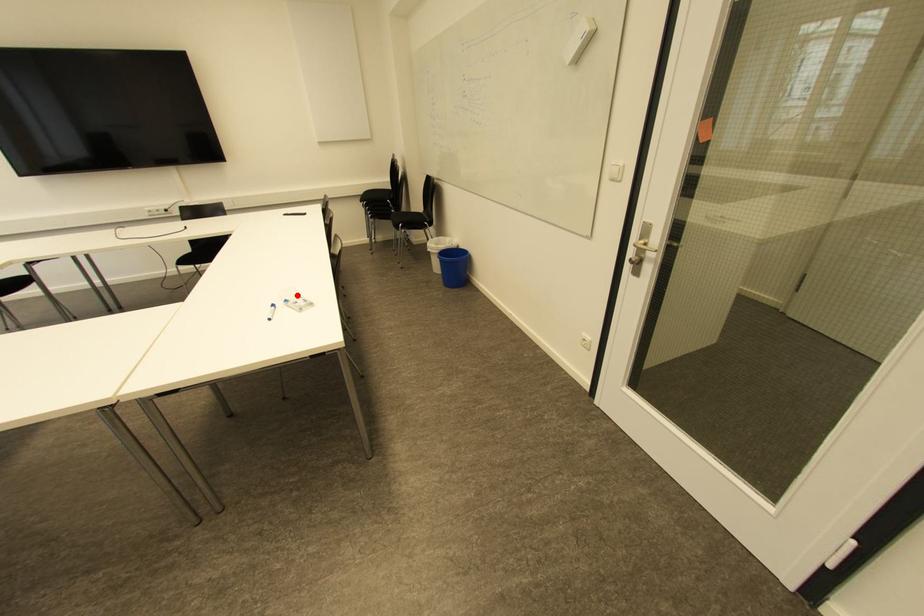
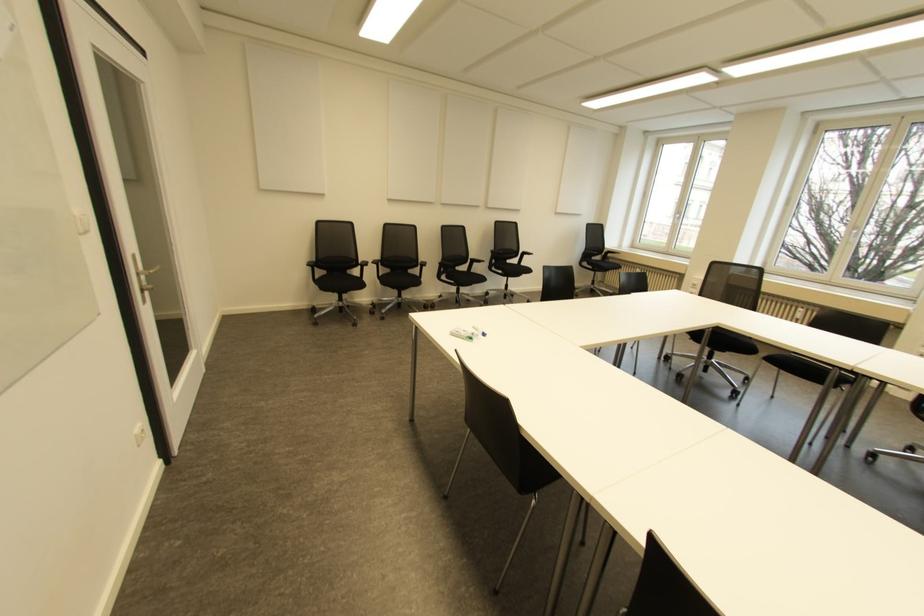
In the second image, find the point that corresponds to the highlighted location in the first image.

(470, 338)